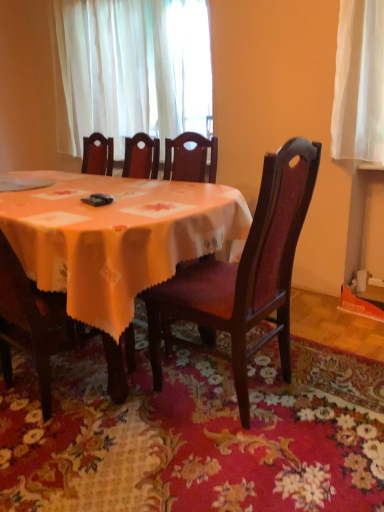
I want to click on free space to the left of matte wood chair at center, which appears as the second chair when viewed from the left, so click(x=127, y=420).